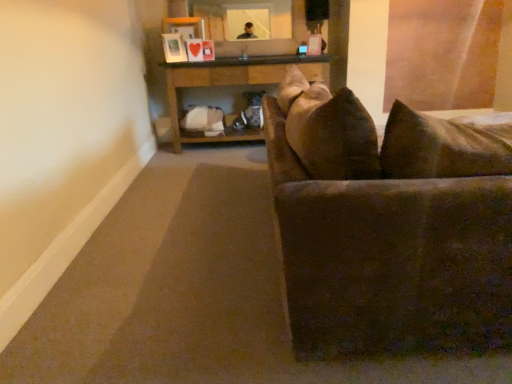
Question: From the image's perspective, is wooden table at center under brown fabric couch at right?

Choices:
 (A) yes
 (B) no

Answer: (B)

Question: Considering the relative sizes of wooden table at center and brown fabric couch at right in the image provided, is wooden table at center thinner than brown fabric couch at right?

Choices:
 (A) yes
 (B) no

Answer: (A)

Question: Is wooden table at center surrounding brown fabric couch at right?

Choices:
 (A) yes
 (B) no

Answer: (B)

Question: Is wooden table at center positioned before brown fabric couch at right?

Choices:
 (A) no
 (B) yes

Answer: (A)

Question: Can you confirm if wooden table at center is shorter than brown fabric couch at right?

Choices:
 (A) no
 (B) yes

Answer: (B)

Question: Considering the relative sizes of wooden table at center and brown fabric couch at right in the image provided, is wooden table at center taller than brown fabric couch at right?

Choices:
 (A) no
 (B) yes

Answer: (A)

Question: Is brown fabric couch at right not within wooden table at center?

Choices:
 (A) yes
 (B) no

Answer: (A)

Question: Is wooden table at center a part of brown fabric couch at right?

Choices:
 (A) yes
 (B) no

Answer: (B)

Question: From the image's perspective, is brown fabric couch at right on wooden table at center?

Choices:
 (A) no
 (B) yes

Answer: (A)

Question: Is brown fabric couch at right oriented away from wooden table at center?

Choices:
 (A) yes
 (B) no

Answer: (B)

Question: Does brown fabric couch at right have a lesser width compared to wooden table at center?

Choices:
 (A) no
 (B) yes

Answer: (A)

Question: Does brown fabric couch at right have a larger size compared to wooden table at center?

Choices:
 (A) yes
 (B) no

Answer: (A)

Question: Would you say wooden table at center is inside or outside brown fabric couch at right?

Choices:
 (A) outside
 (B) inside

Answer: (A)